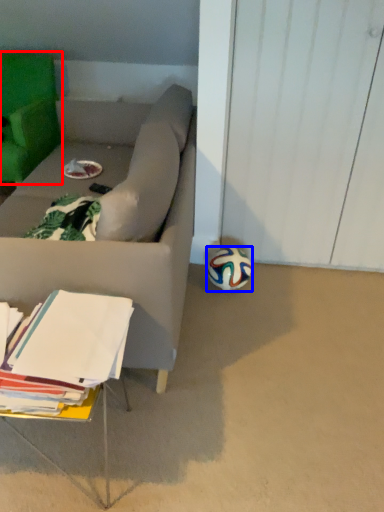
Question: Which object is further to the camera taking this photo, chair (highlighted by a red box) or ball (highlighted by a blue box)?

Choices:
 (A) chair
 (B) ball

Answer: (A)